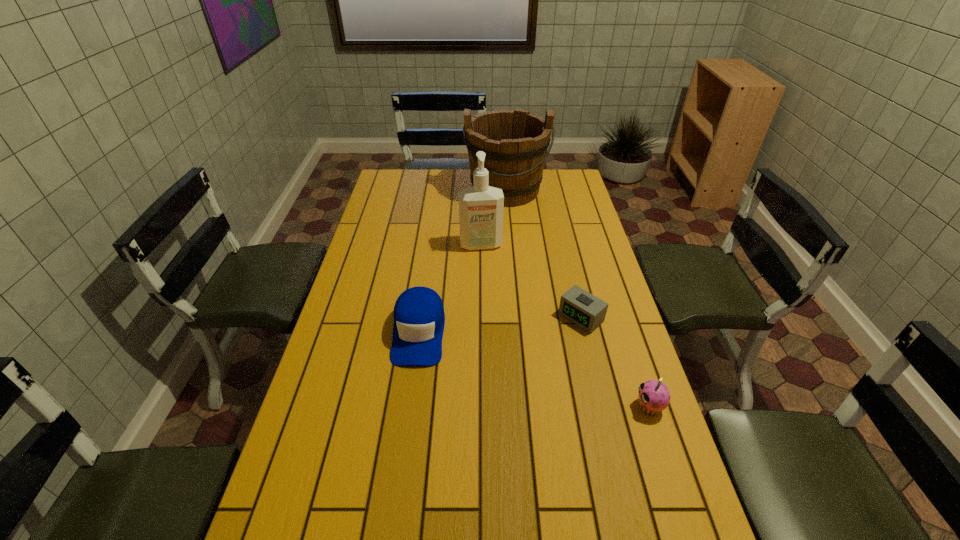
This screenshot has height=540, width=960. Identify the location of vacant space located on the front-facing side of the shortest object. (488, 399).

This screenshot has height=540, width=960. In order to click on vacant space located on the front-facing side of the shortest object in this screenshot , I will do `click(498, 390)`.

Locate an element on the screen. vacant space located on the front-facing side of the shortest object is located at coordinates (485, 401).

The width and height of the screenshot is (960, 540). Identify the location of free location located on the front label of the cleansing agent. [x=487, y=273].

You are a GUI agent. You are given a task and a screenshot of the screen. Output one action in this format:
    pyautogui.click(x=<x>, y=<y>)
    Task: Click on the blank space located on the front label of the cleansing agent
    This screenshot has width=960, height=540.
    Given the screenshot: What is the action you would take?
    pyautogui.click(x=489, y=286)

In order to click on vacant space positioned on the front label of the cleansing agent in this screenshot , I will do `click(490, 294)`.

Locate an element on the screen. free spot located 0.190m on the side of the wine bucket with the handle for carrying is located at coordinates (508, 238).

I want to click on vacant area situated on the side of the wine bucket with the handle for carrying, so pyautogui.click(x=507, y=225).

Identify the location of vacant space located on the side of the wine bucket with the handle for carrying. (508, 244).

Find the location of a particular element. The width and height of the screenshot is (960, 540). object that is at the far edge is located at coordinates [x=515, y=142].